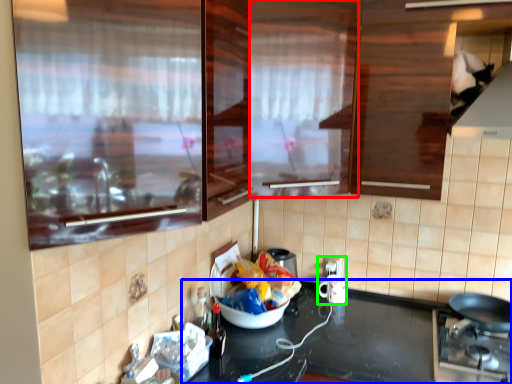
Question: Which object is positioned closest to glass door (highlighted by a red box)? Select from countertop (highlighted by a blue box) and appliance (highlighted by a green box).

Choices:
 (A) countertop
 (B) appliance

Answer: (A)